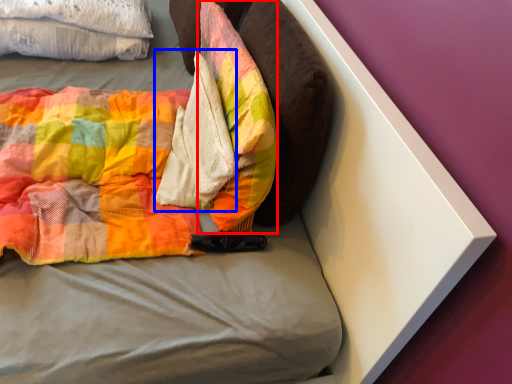
Question: Which point is further to the camera, pillow (highlighted by a red box) or material (highlighted by a blue box)?

Choices:
 (A) pillow
 (B) material

Answer: (B)